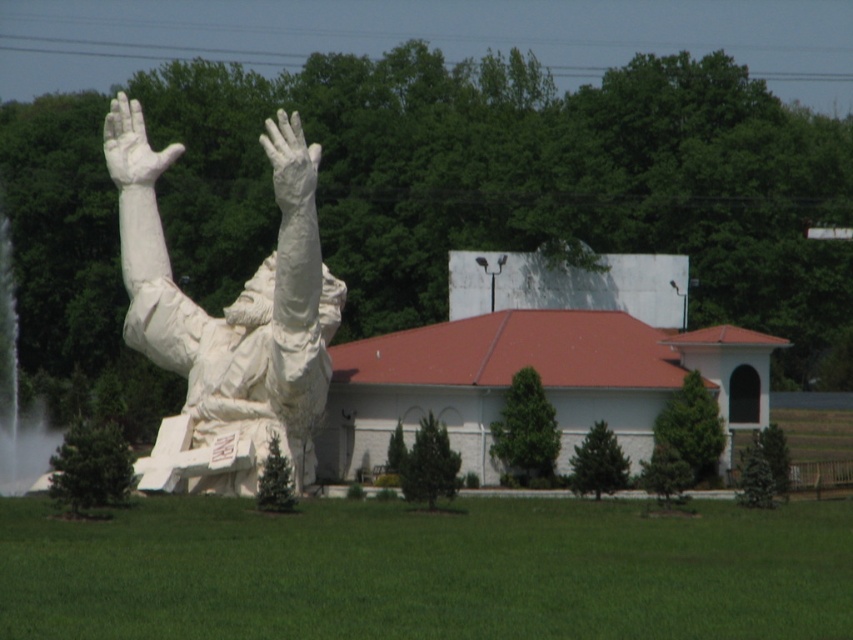
You are a visitor at the statue and want to take a photo of the white frothy water at left and the white marble hand at upper center. Which object should you focus on first if you want to capture both in the same frame without moving the camera?

You should focus on the white marble hand at upper center first because the white frothy water at left is much taller, so adjusting focus to the closer object will ensure both are in the frame.

You are standing in front of the statue and notice a point marked at coordinates (16, 392). What object is located at that point?

The point at (16, 392) corresponds to the white frothy water at left.

You are standing in front of the statue and want to find the white frothy water at left. Based on your current position, in which direction should you look to see it?

Since the white frothy water at left is located at point [16,392], you should look to your left to see it.